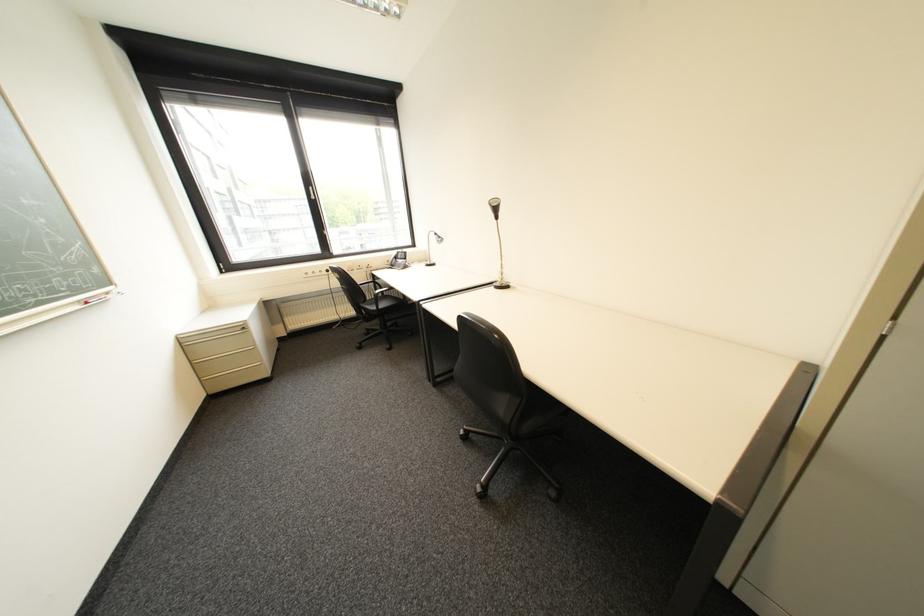
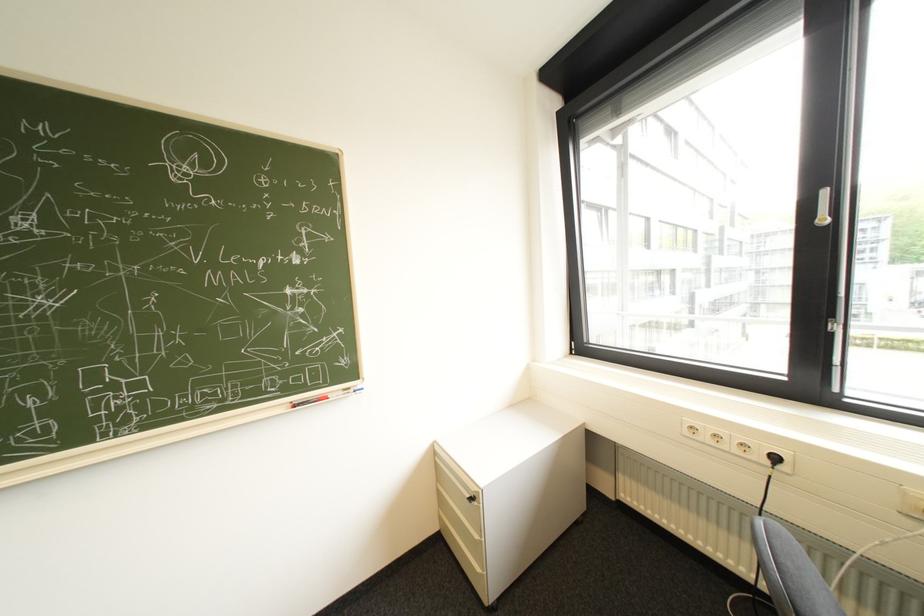
The point at (321, 275) is marked in the first image. Where is the corresponding point in the second image?

(715, 438)